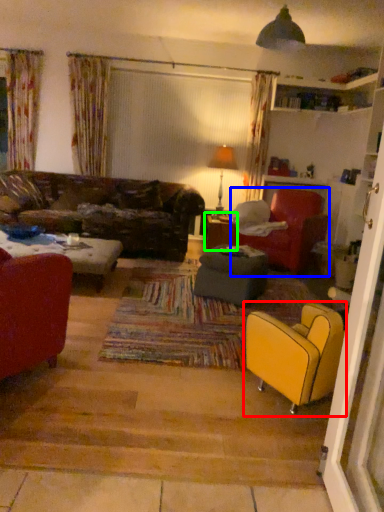
Question: Considering the real-world distances, which object is farthest from chair (highlighted by a red box)? chair (highlighted by a blue box) or table (highlighted by a green box)?

Choices:
 (A) chair
 (B) table

Answer: (B)